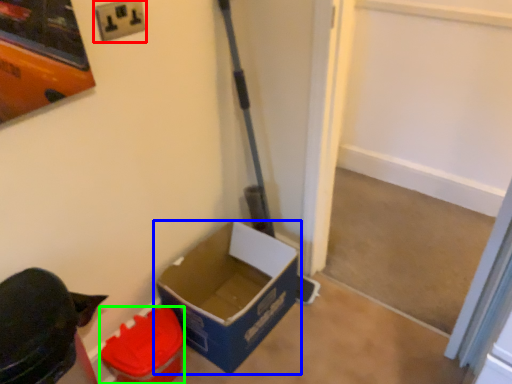
Question: Which is nearer to the electric outlet (highlighted by a red box)? box (highlighted by a blue box) or box (highlighted by a green box).

Choices:
 (A) box
 (B) box

Answer: (B)